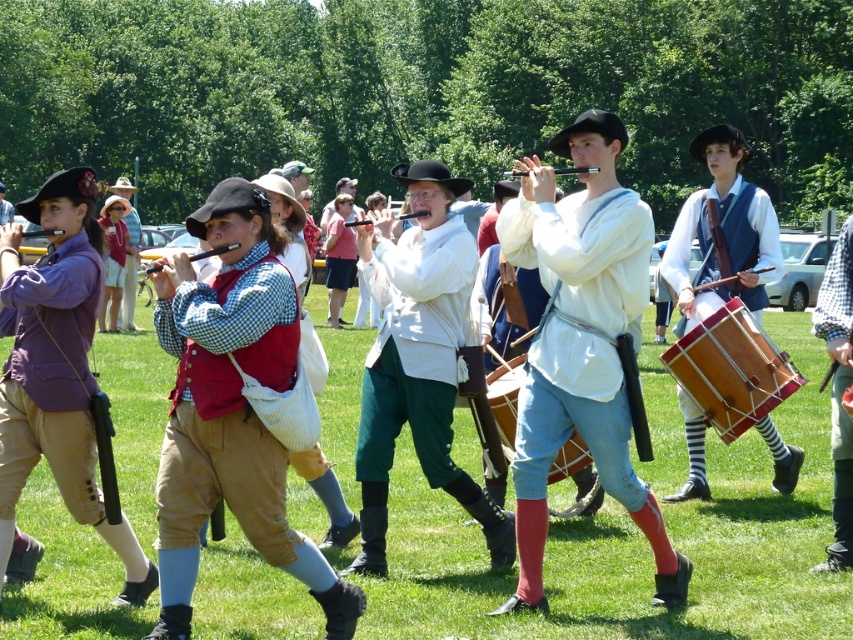
Question: Which object is positioned closest to the matte white shirt at center?

Choices:
 (A) matte red vest at center
 (B) wooden drum at right
 (C) purple cotton vest at left

Answer: (B)

Question: Can you confirm if blue velvet vest at center is wider than matte wood flute at center?

Choices:
 (A) yes
 (B) no

Answer: (B)

Question: Is matte red vest at center in front of purple cotton vest at left?

Choices:
 (A) yes
 (B) no

Answer: (A)

Question: Which point appears closest to the camera in this image?

Choices:
 (A) (560, 458)
 (B) (775, 460)
 (C) (692, 381)
 (D) (74, 209)

Answer: (D)

Question: Does green grass at center have a lesser width compared to matte white shirt at center?

Choices:
 (A) yes
 (B) no

Answer: (B)

Question: Estimate the real-world distances between objects in this image. Which object is farther from the white cotton shirt at center?

Choices:
 (A) wooden drum at center
 (B) wooden drum at right
 (C) purple cotton vest at left

Answer: (B)